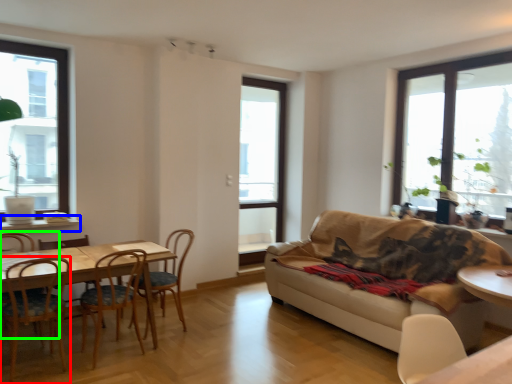
Question: Considering the real-world distances, which object is farthest from chair (highlighted by a red box)? window sill (highlighted by a blue box) or chair (highlighted by a green box)?

Choices:
 (A) window sill
 (B) chair

Answer: (A)